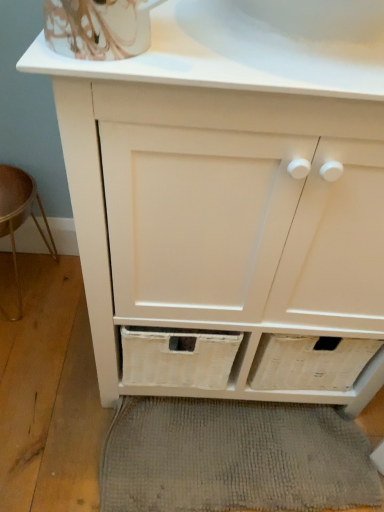
The height and width of the screenshot is (512, 384). Describe the element at coordinates (19, 215) in the screenshot. I see `wooden stool at lower left` at that location.

What is the approximate height of white porcelain sink at upper center?

3.23 inches.

Where is `wooden stool at lower left`? The image size is (384, 512). wooden stool at lower left is located at coordinates (19, 215).

Locate an element on the screen. The height and width of the screenshot is (512, 384). bath mat below the white porcelain sink at upper center (from a real-world perspective) is located at coordinates (233, 457).

From the picture: Is the depth of gray woven bath mat at lower center greater than that of white porcelain sink at upper center?

Yes, it is.

Consider the image. Between gray woven bath mat at lower center and white porcelain sink at upper center, which one appears on the right side from the viewer's perspective?

white porcelain sink at upper center is more to the right.

In order to click on bar stool that is above the gray woven bath mat at lower center (from a real-world perspective) in this screenshot , I will do `click(19, 215)`.

Is gray woven bath mat at lower center aimed at wooden stool at lower left?

No.

Who is shorter, gray woven bath mat at lower center or wooden stool at lower left?

gray woven bath mat at lower center is shorter.

From a real-world perspective, which is physically below, gray woven bath mat at lower center or wooden stool at lower left?

gray woven bath mat at lower center, from a real-world perspective.

Considering the positions of objects wooden stool at lower left and white porcelain sink at upper center in the image provided, who is more to the left, wooden stool at lower left or white porcelain sink at upper center?

wooden stool at lower left.

How far apart are wooden stool at lower left and white porcelain sink at upper center?

A distance of 81.08 centimeters exists between wooden stool at lower left and white porcelain sink at upper center.

From the image's perspective, is wooden stool at lower left positioned above or below white porcelain sink at upper center?

Clearly, from the image's perspective, wooden stool at lower left is below white porcelain sink at upper center.

Looking at their sizes, would you say wooden stool at lower left is wider or thinner than white porcelain sink at upper center?

Considering their sizes, wooden stool at lower left looks slimmer than white porcelain sink at upper center.

Is white porcelain sink at upper center not close to gray woven bath mat at lower center?

That's not correct — white porcelain sink at upper center is a little close to gray woven bath mat at lower center.

Considering the positions of objects white porcelain sink at upper center and gray woven bath mat at lower center in the image provided, who is more to the right, white porcelain sink at upper center or gray woven bath mat at lower center?

white porcelain sink at upper center.

Which object is more forward, white porcelain sink at upper center or gray woven bath mat at lower center?

white porcelain sink at upper center is more forward.

Considering the sizes of objects wooden stool at lower left and gray woven bath mat at lower center in the image provided, who is smaller, wooden stool at lower left or gray woven bath mat at lower center?

gray woven bath mat at lower center.

Which object is wider, wooden stool at lower left or gray woven bath mat at lower center?

gray woven bath mat at lower center.

Is point (4, 185) more distant than point (108, 466)?

Yes, point (4, 185) is behind point (108, 466).

Would you say wooden stool at lower left is a long distance from gray woven bath mat at lower center?

wooden stool at lower left is near gray woven bath mat at lower center, not far away.

Which is nearer, (370, 24) or (0, 225)?

Point (370, 24) appears to be closer to the viewer than point (0, 225).

Is white porcelain sink at upper center far away from wooden stool at lower left?

No, white porcelain sink at upper center is not far away from wooden stool at lower left.

Considering the positions of objects white porcelain sink at upper center and wooden stool at lower left in the image provided, who is more to the right, white porcelain sink at upper center or wooden stool at lower left?

white porcelain sink at upper center is more to the right.

Does white porcelain sink at upper center have a larger size compared to wooden stool at lower left?

Incorrect, white porcelain sink at upper center is not larger than wooden stool at lower left.

The image size is (384, 512). I want to click on sink in front of the gray woven bath mat at lower center, so click(x=295, y=38).

What are the coordinates of `bar stool behind the gray woven bath mat at lower center` in the screenshot? It's located at (19, 215).

Considering their positions, is wooden stool at lower left positioned further to gray woven bath mat at lower center than white porcelain sink at upper center?

Among the two, white porcelain sink at upper center is located further to gray woven bath mat at lower center.

Estimate the real-world distances between objects in this image. Which object is closer to white porcelain sink at upper center, gray woven bath mat at lower center or wooden stool at lower left?

Among the two, wooden stool at lower left is located nearer to white porcelain sink at upper center.

Considering their positions, is white porcelain sink at upper center positioned further to gray woven bath mat at lower center than wooden stool at lower left?

white porcelain sink at upper center.

Looking at the image, which one is located further to wooden stool at lower left, gray woven bath mat at lower center or white porcelain sink at upper center?

white porcelain sink at upper center is further to wooden stool at lower left.

When comparing their distances from wooden stool at lower left, does white porcelain sink at upper center or gray woven bath mat at lower center seem closer?

Based on the image, gray woven bath mat at lower center appears to be nearer to wooden stool at lower left.

When comparing their distances from white porcelain sink at upper center, does wooden stool at lower left or gray woven bath mat at lower center seem further?

gray woven bath mat at lower center is positioned further to the anchor white porcelain sink at upper center.

The image size is (384, 512). I want to click on bar stool between white porcelain sink at upper center and gray woven bath mat at lower center in the vertical direction, so click(19, 215).